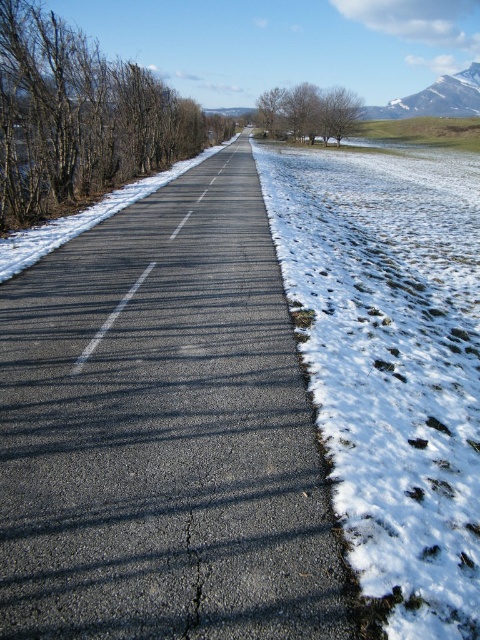
Question: Does white powdery snow at right have a greater width compared to snowy granite mountain at upper right?

Choices:
 (A) yes
 (B) no

Answer: (B)

Question: Which point is farther to the camera?

Choices:
 (A) (421, 112)
 (B) (348, 436)

Answer: (A)

Question: Is white powdery snow at right positioned in front of snowy granite mountain at upper right?

Choices:
 (A) no
 (B) yes

Answer: (B)

Question: Does white powdery snow at right have a smaller size compared to snowy granite mountain at upper right?

Choices:
 (A) yes
 (B) no

Answer: (A)